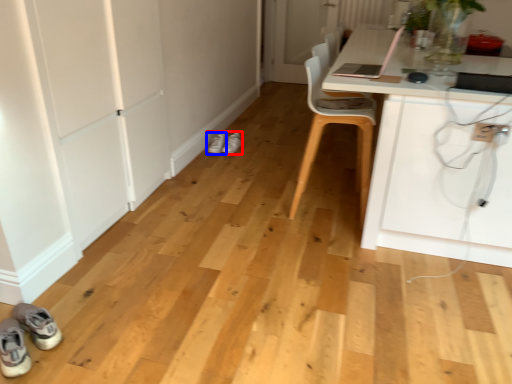
Question: Which object appears closest to the camera in this image, footwear (highlighted by a red box) or footwear (highlighted by a blue box)?

Choices:
 (A) footwear
 (B) footwear

Answer: (B)